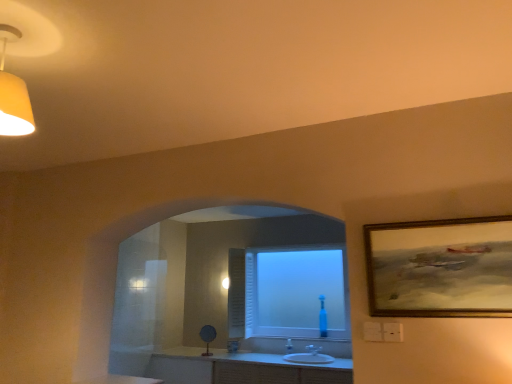
Question: Does white glossy counter top at lower center have a larger size compared to frosted glass window at center?

Choices:
 (A) no
 (B) yes

Answer: (A)

Question: Is white glossy counter top at lower center thinner than frosted glass window at center?

Choices:
 (A) no
 (B) yes

Answer: (A)

Question: Is there a large distance between white glossy counter top at lower center and frosted glass window at center?

Choices:
 (A) yes
 (B) no

Answer: (A)

Question: Can you confirm if white glossy counter top at lower center is wider than frosted glass window at center?

Choices:
 (A) no
 (B) yes

Answer: (B)

Question: Does white glossy counter top at lower center have a smaller size compared to frosted glass window at center?

Choices:
 (A) no
 (B) yes

Answer: (B)

Question: Is gold-framed painting at upper right inside or outside of white glossy counter top at lower center?

Choices:
 (A) outside
 (B) inside

Answer: (A)

Question: Is point (394, 281) positioned closer to the camera than point (131, 379)?

Choices:
 (A) closer
 (B) farther

Answer: (A)

Question: Visually, is gold-framed painting at upper right positioned to the left or to the right of white glossy counter top at lower center?

Choices:
 (A) left
 (B) right

Answer: (B)

Question: Is gold-framed painting at upper right wider or thinner than white glossy counter top at lower center?

Choices:
 (A) wide
 (B) thin

Answer: (B)

Question: Is point (98, 380) positioned closer to the camera than point (325, 355)?

Choices:
 (A) farther
 (B) closer

Answer: (B)

Question: Relative to white glossy sink at center, is white glossy counter top at lower center in front or behind?

Choices:
 (A) behind
 (B) front

Answer: (B)

Question: From the image's perspective, is white glossy counter top at lower center positioned above or below white glossy sink at center?

Choices:
 (A) above
 (B) below

Answer: (A)

Question: From a real-world perspective, is white glossy counter top at lower center physically located above or below white glossy sink at center?

Choices:
 (A) below
 (B) above

Answer: (B)

Question: From the image's perspective, relative to white glossy sink at center, is frosted glass window at center above or below?

Choices:
 (A) above
 (B) below

Answer: (A)

Question: Relative to white glossy sink at center, is frosted glass window at center in front or behind?

Choices:
 (A) front
 (B) behind

Answer: (B)